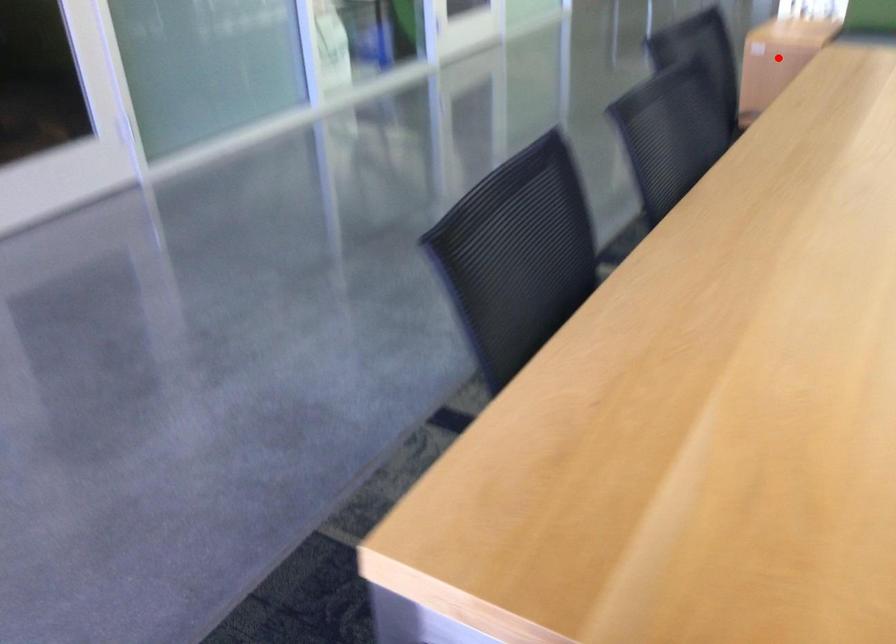
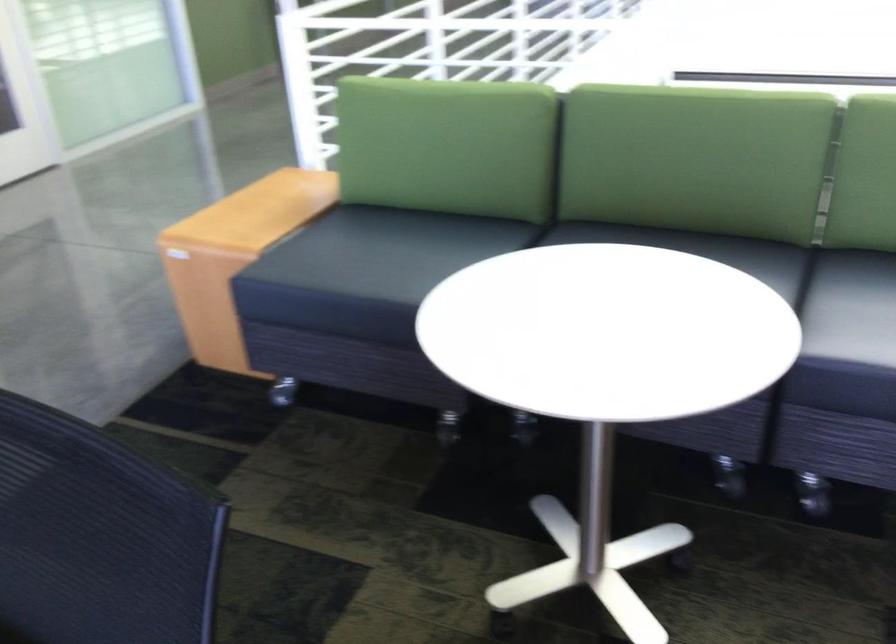
Question: I am providing you with two images of the same scene from different viewpoints. A red point is marked on the first image. Can you still see the location of the red point in image 2?

Choices:
 (A) Yes
 (B) No

Answer: (B)